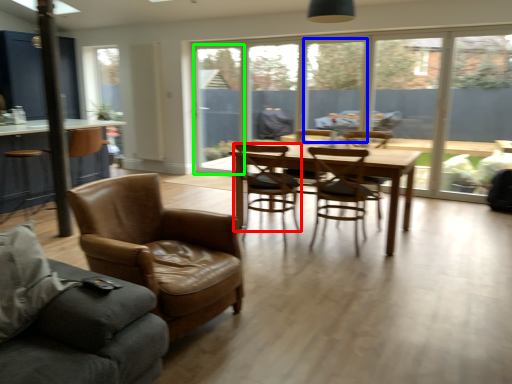
Question: Which object is positioned farthest from chair (highlighted by a red box)? Select from window (highlighted by a blue box) and window screen (highlighted by a green box).

Choices:
 (A) window
 (B) window screen

Answer: (A)